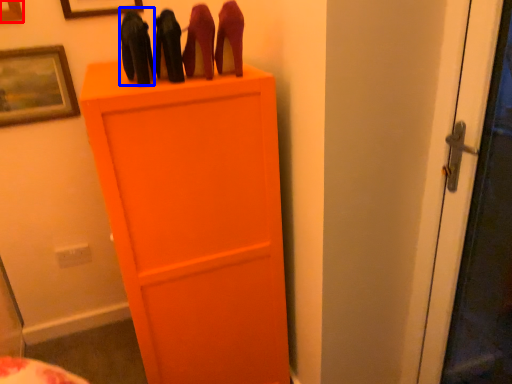
Question: Which object is further to the camera taking this photo, picture frame (highlighted by a red box) or stuff (highlighted by a blue box)?

Choices:
 (A) picture frame
 (B) stuff

Answer: (A)